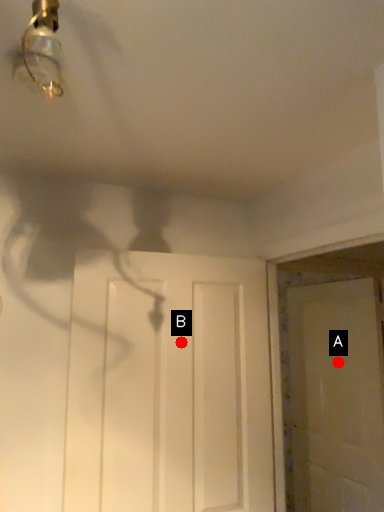
Question: Two points are circled on the image, labeled by A and B beside each circle. Among these points, which one is farthest from the camera?

Choices:
 (A) A is further
 (B) B is further

Answer: (A)